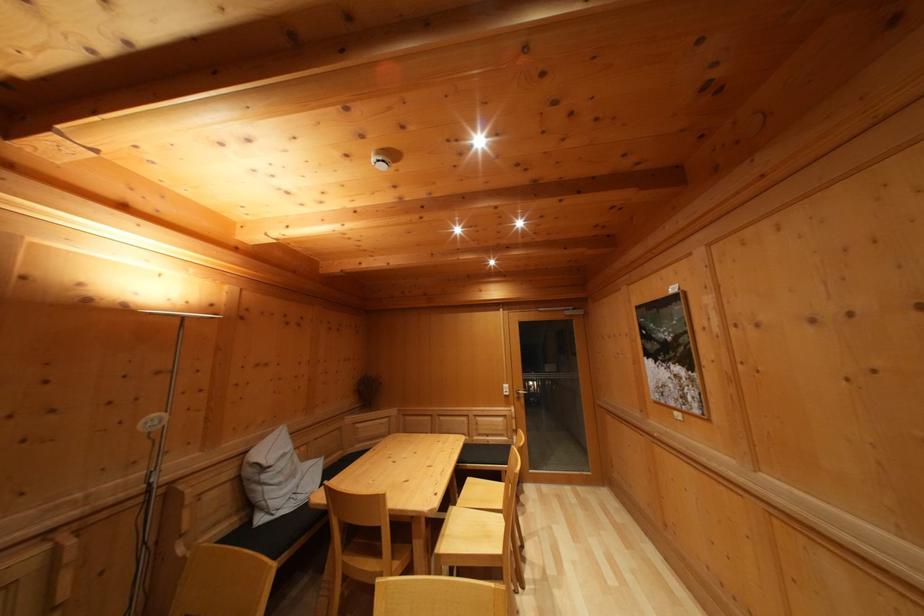
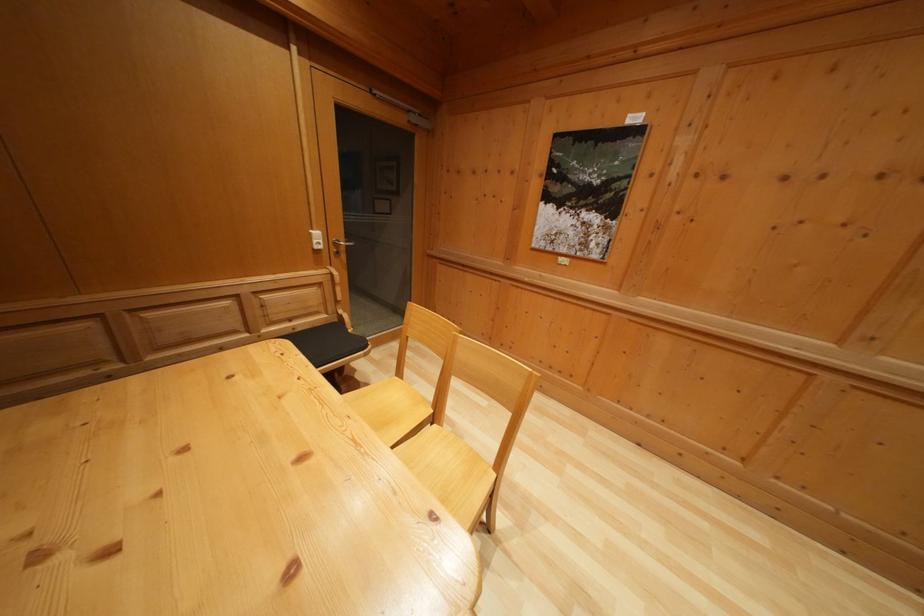
The point at (496, 450) is marked in the first image. Where is the corresponding point in the second image?

(305, 336)